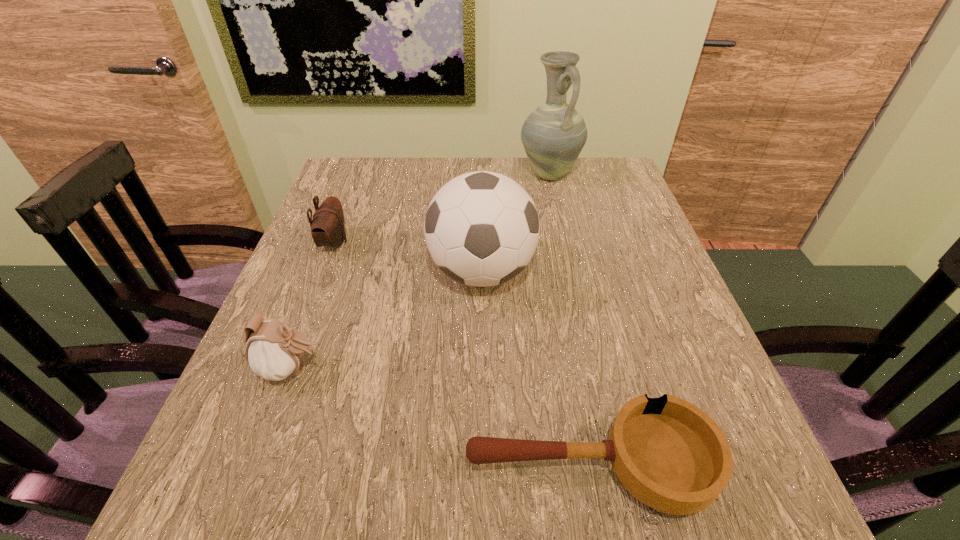
The height and width of the screenshot is (540, 960). In order to click on pitcher in this screenshot , I will do `click(553, 135)`.

Where is `the tallest object`? the tallest object is located at coordinates (553, 135).

This screenshot has height=540, width=960. What are the coordinates of `soccer ball` in the screenshot? It's located at (482, 228).

At what (x,y) coordinates should I click in order to perform the action: click on the nearer pouch. Please return your answer as a coordinate pair (x, y). Looking at the image, I should click on (274, 350).

You are a GUI agent. You are given a task and a screenshot of the screen. Output one action in this format:
    pyautogui.click(x=<x>, y=<y>)
    Task: Click on the farther pouch
    
    Given the screenshot: What is the action you would take?
    pyautogui.click(x=327, y=226)

Locate an element on the screen. the nearest object is located at coordinates pos(669,454).

Locate an element on the screen. This screenshot has height=540, width=960. the shortest object is located at coordinates (669, 454).

Locate an element on the screen. Image resolution: width=960 pixels, height=540 pixels. blank space located 0.300m on the handle side of the farthest object is located at coordinates (569, 262).

You are a GUI agent. You are given a task and a screenshot of the screen. Output one action in this format:
    pyautogui.click(x=<x>, y=<y>)
    Task: Click on the free space located 0.240m on the back of the soccer ball
    The image size is (960, 540).
    Given the screenshot: What is the action you would take?
    481,186

Locate an element on the screen. This screenshot has width=960, height=540. free space located 0.090m on the front-facing side of the fourth farthest object is located at coordinates (373, 369).